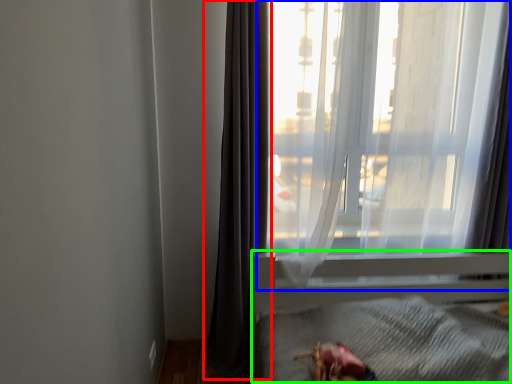
Question: Considering the real-world distances, which object is farthest from curtain (highlighted by a red box)? window (highlighted by a blue box) or bed frame (highlighted by a green box)?

Choices:
 (A) window
 (B) bed frame

Answer: (B)